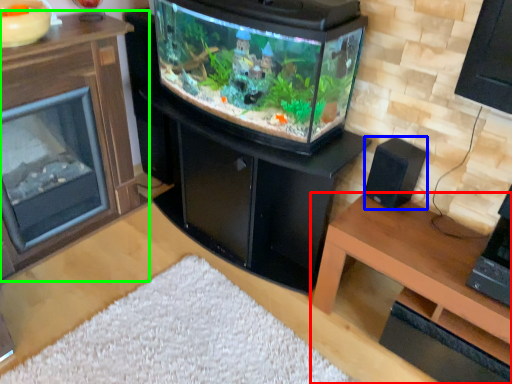
Question: Which is nearer to the table (highlighted by a red box)? speaker (highlighted by a blue box) or furniture (highlighted by a green box).

Choices:
 (A) speaker
 (B) furniture

Answer: (A)